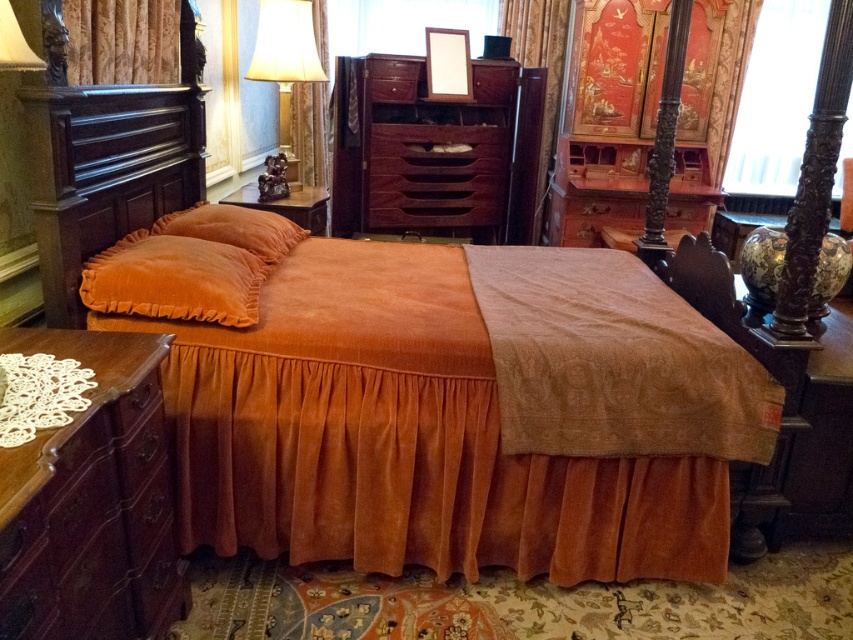
You are arranging flowers in the bedroom and want to place a vase between the velvet orange pillow at upper left and the velvet curtain at upper left. Based on their positions, where should the vase be placed?

The velvet orange pillow at upper left is positioned under the velvet curtain at upper left, so placing the vase between them would require positioning it below the velvet curtain at upper left and above the velvet orange pillow at upper left.

In the vintage bedroom scene, there is a velvet orange blanket at center and a velvet orange pillow at upper left. From the perspective of someone standing at the foot of the bed, which object is positioned to the right?

The velvet orange blanket at center is to the right of the velvet orange pillow at upper left.